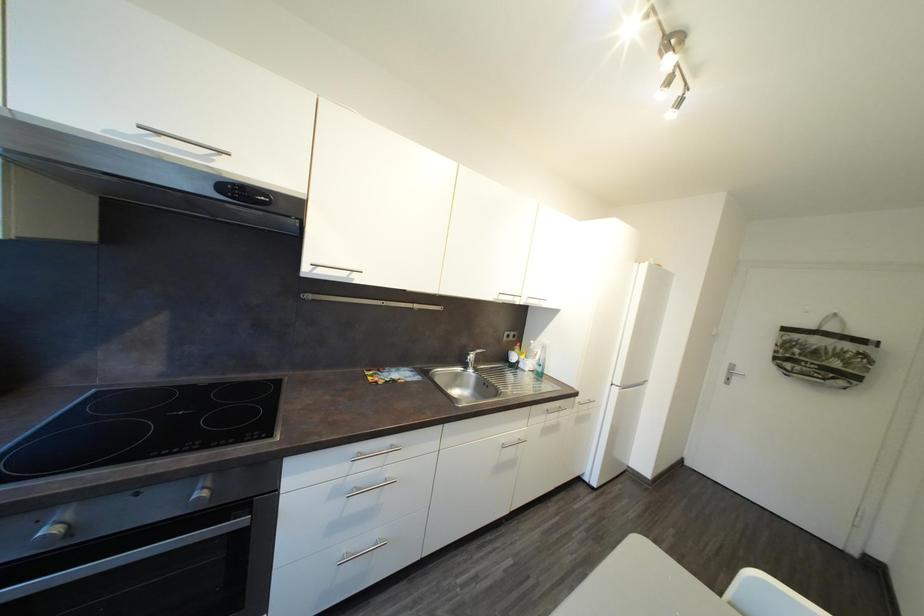
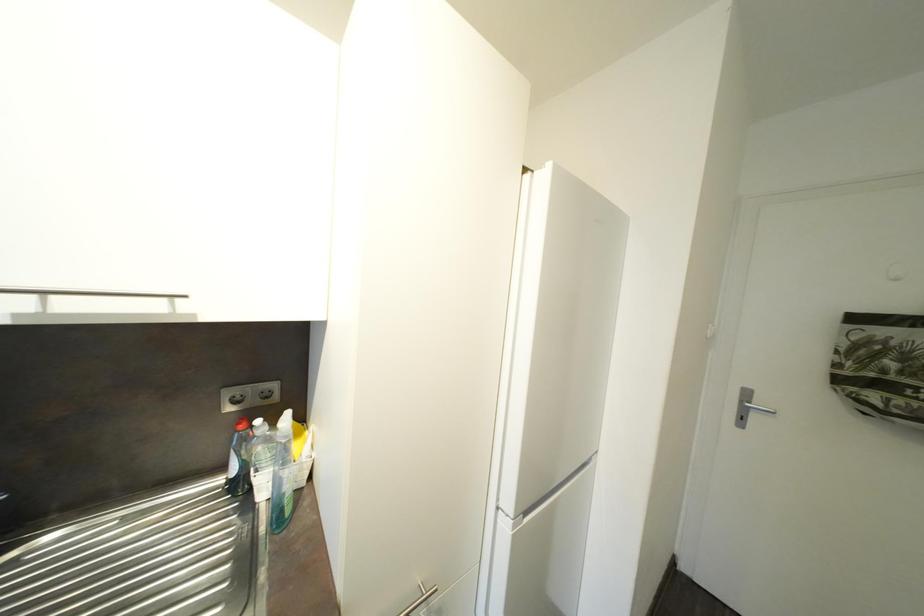
In a continuous first-person perspective shot, in which direction is the camera moving?

The movement direction of the cameraman is right, forward.